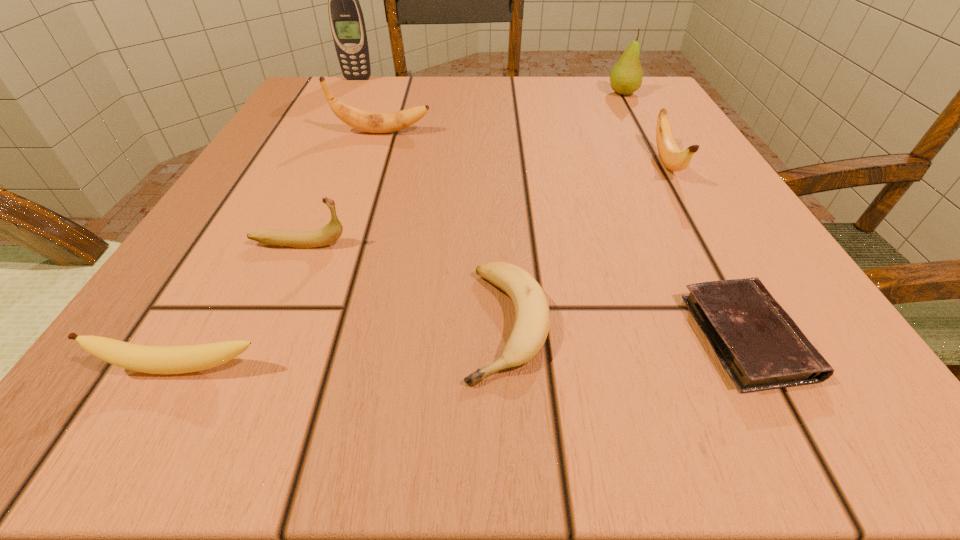
You are a GUI agent. You are given a task and a screenshot of the screen. Output one action in this format:
    pyautogui.click(x=<x>, y=<y>)
    Task: Click on the free space between the pear and the diary
    This screenshot has width=960, height=540.
    Given the screenshot: What is the action you would take?
    pyautogui.click(x=684, y=215)

Where is `empty space that is in between the third shortest object and the fourth object from right to left`? empty space that is in between the third shortest object and the fourth object from right to left is located at coordinates (346, 346).

You are a GUI agent. You are given a task and a screenshot of the screen. Output one action in this format:
    pyautogui.click(x=<x>, y=<y>)
    Task: Click on the free area in between the fourth nearest banana and the third nearest banana
    The image size is (960, 540).
    Given the screenshot: What is the action you would take?
    pyautogui.click(x=483, y=204)

Where is `free space between the third nearest banana and the shortest banana`? The height and width of the screenshot is (540, 960). free space between the third nearest banana and the shortest banana is located at coordinates (403, 284).

Identify the location of vacant space that's between the fourth farthest object and the tallest banana. The height and width of the screenshot is (540, 960). (524, 148).

Where is `free spot between the diary and the cellular telephone`? free spot between the diary and the cellular telephone is located at coordinates (552, 208).

I want to click on free space that is in between the fourth nearest object and the cellular telephone, so click(x=328, y=161).

I want to click on free space between the second shortest banana and the second farthest banana, so click(x=425, y=266).

Where is `vacant area that lies between the third nearest banana and the tallest object`? The image size is (960, 540). vacant area that lies between the third nearest banana and the tallest object is located at coordinates (328, 161).

Identify which object is the fourth nearest to the shortest object. Please provide its 2D coordinates. Your answer should be formatted as a tuple, i.e. [(x, y)], where the tuple contains the x and y coordinates of a point satisfying the conditions above.

[(189, 358)]